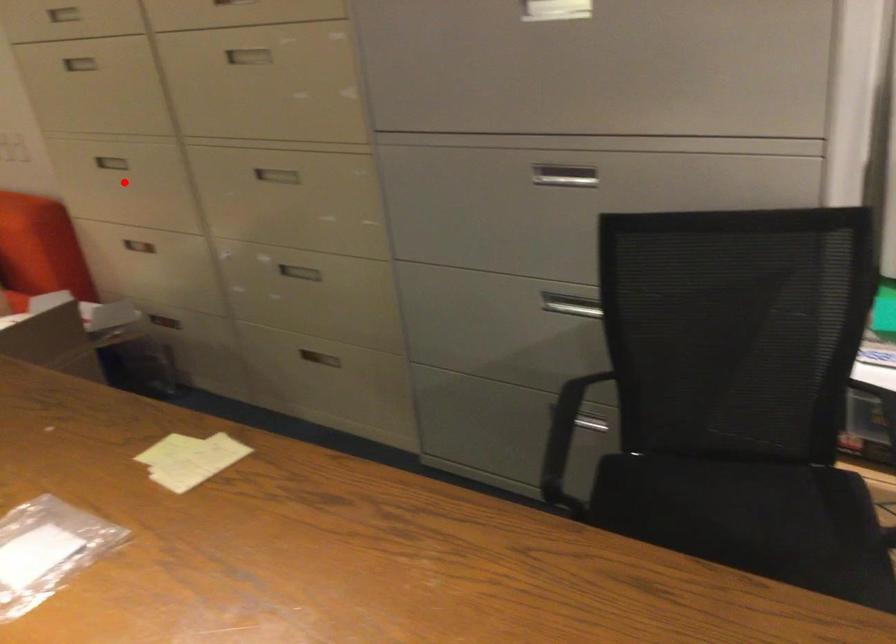
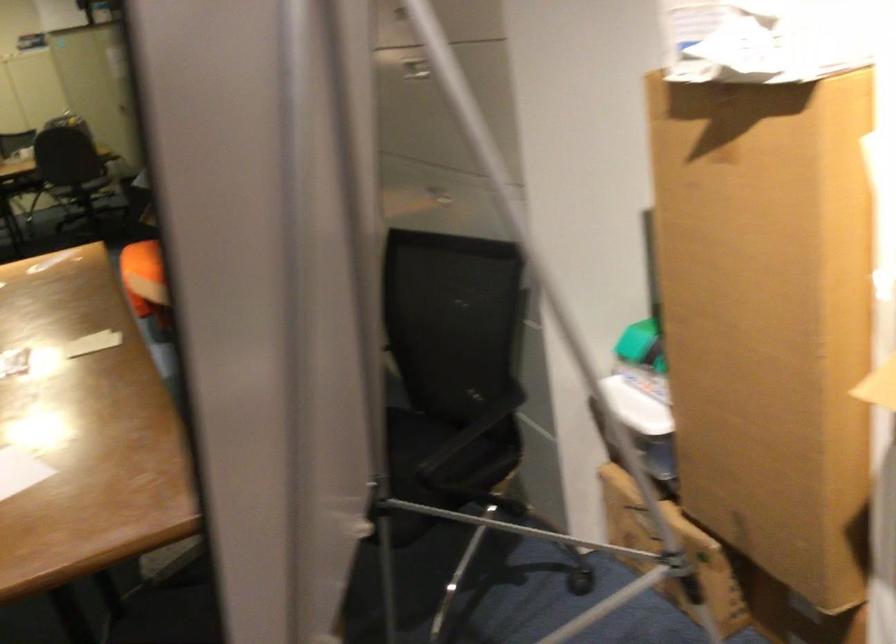
Question: I am providing you with two images of the same scene from different viewpoints. A red point is marked on the first image. Is the red point's position out of view in image 2?

Choices:
 (A) Yes
 (B) No

Answer: (A)